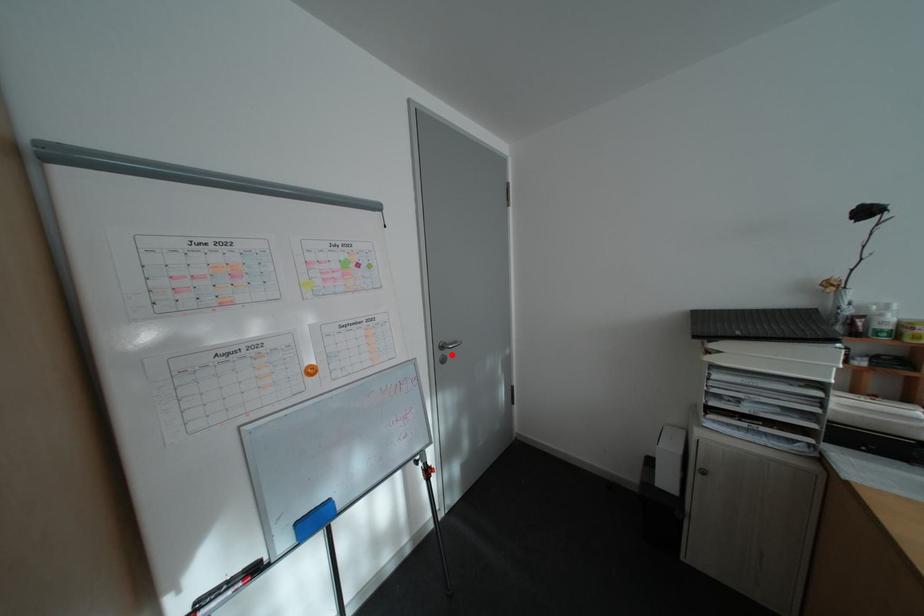
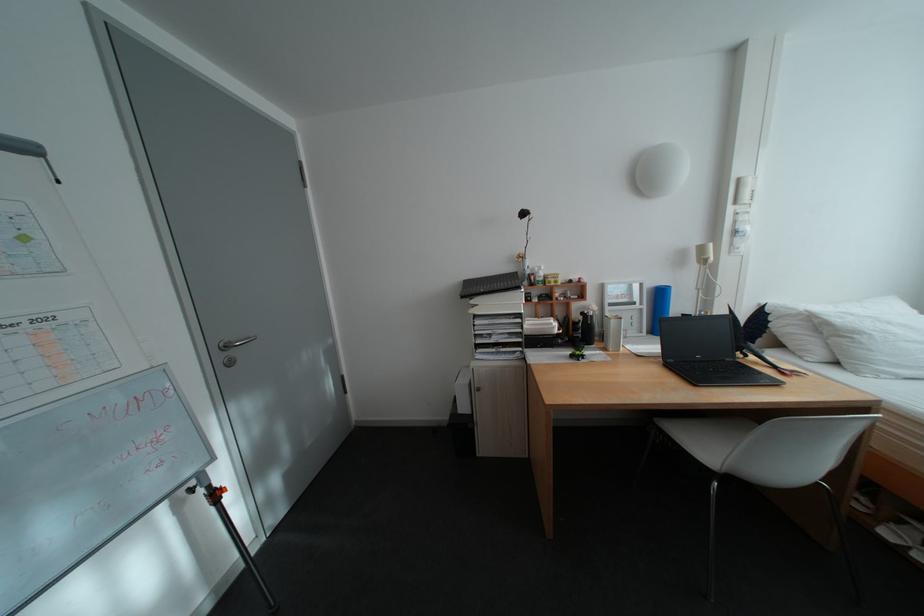
Where in the second image is the point corresponding to the highlighted location from the first image?

(234, 358)